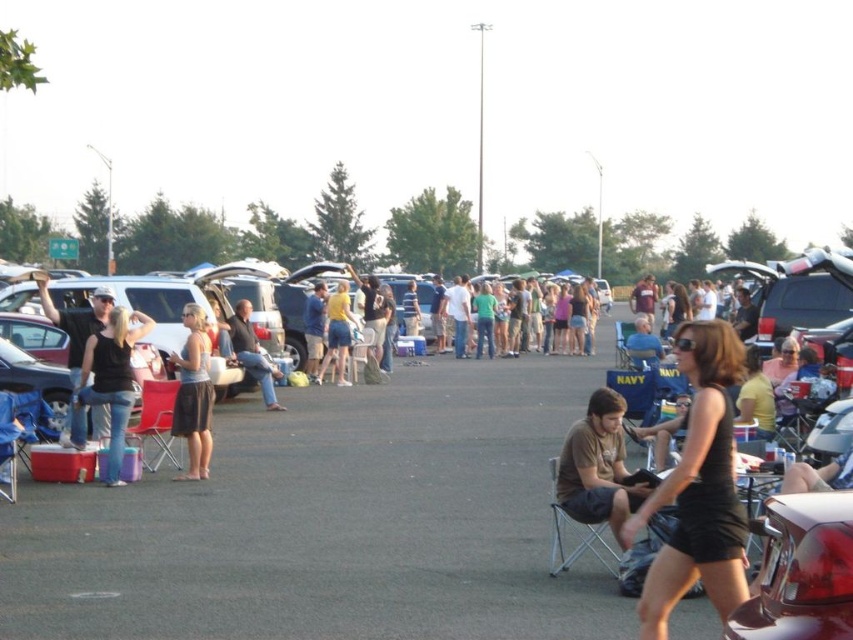
Question: Does shiny red tail light at lower right appear on the left side of metallic silver folding chair at center?

Choices:
 (A) no
 (B) yes

Answer: (B)

Question: From the image, what is the correct spatial relationship of matte black car at center in relation to brown cotton shirt at center?

Choices:
 (A) above
 (B) below

Answer: (B)

Question: Which point is closer to the camera?

Choices:
 (A) (227, 324)
 (B) (137, 332)
 (C) (733, 612)
 (D) (633, 328)

Answer: (C)

Question: Estimate the real-world distances between objects in this image. Which object is farther from the matte black folding chair at center?

Choices:
 (A) yellow shirt at center
 (B) matte gray skirt at center

Answer: (A)

Question: Can you confirm if brown cotton shirt at center is positioned to the right of matte black tank top at left?

Choices:
 (A) no
 (B) yes

Answer: (B)

Question: Which of the following is the closest to the observer?

Choices:
 (A) (596, 516)
 (B) (231, 477)
 (C) (840, 625)

Answer: (C)